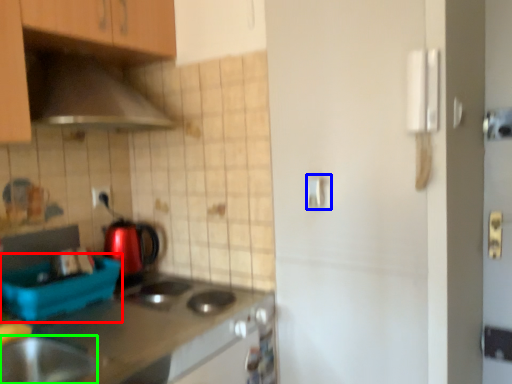
Question: Based on their relative distances, which object is farther from appliance (highlighted by a red box)? Choose from door handle (highlighted by a blue box) and home appliance (highlighted by a green box).

Choices:
 (A) door handle
 (B) home appliance

Answer: (A)